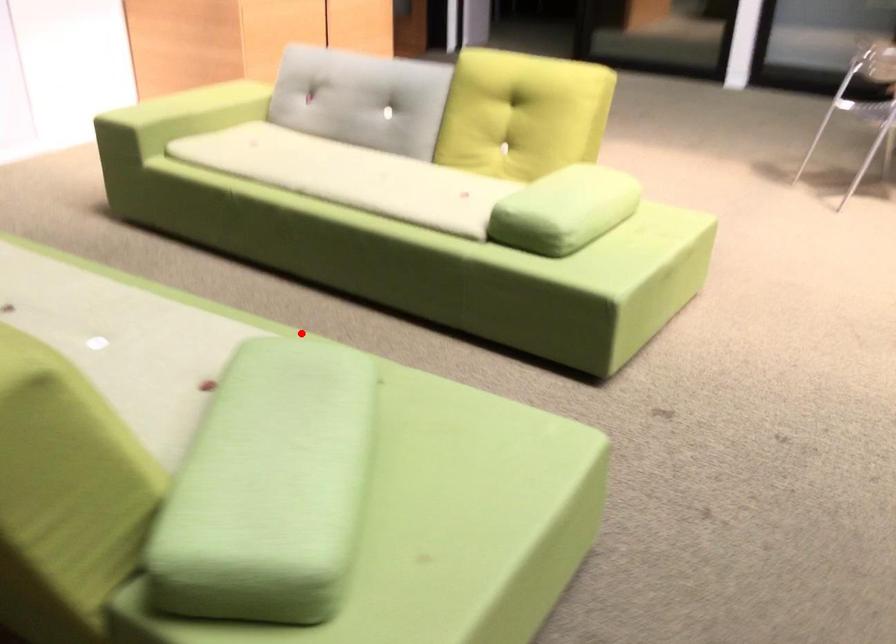
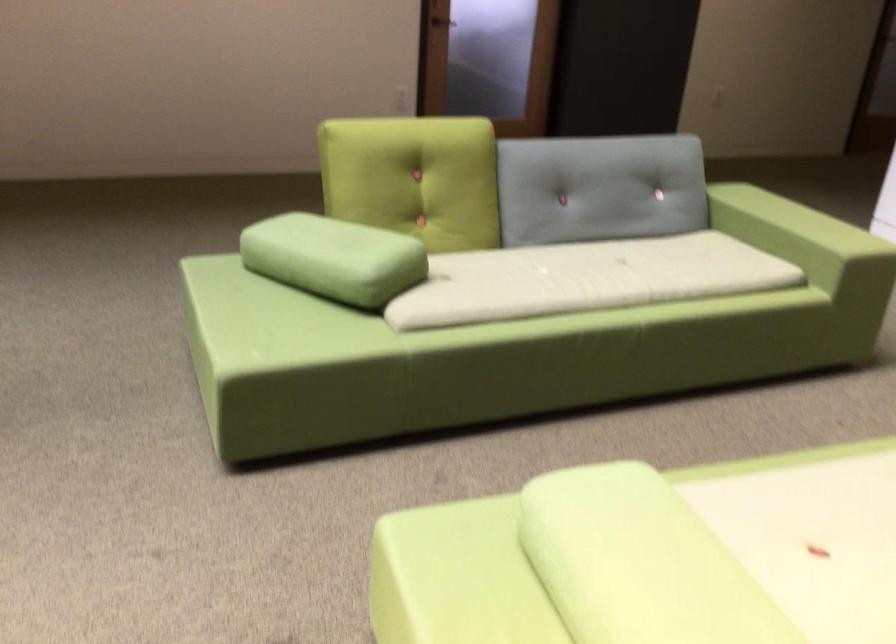
Question: I am providing you with two images of the same scene from different viewpoints. Given a red point in image1, look at the same physical point in image2. Is it:

Choices:
 (A) Closer to the viewpoint
 (B) Farther from the viewpoint

Answer: (B)